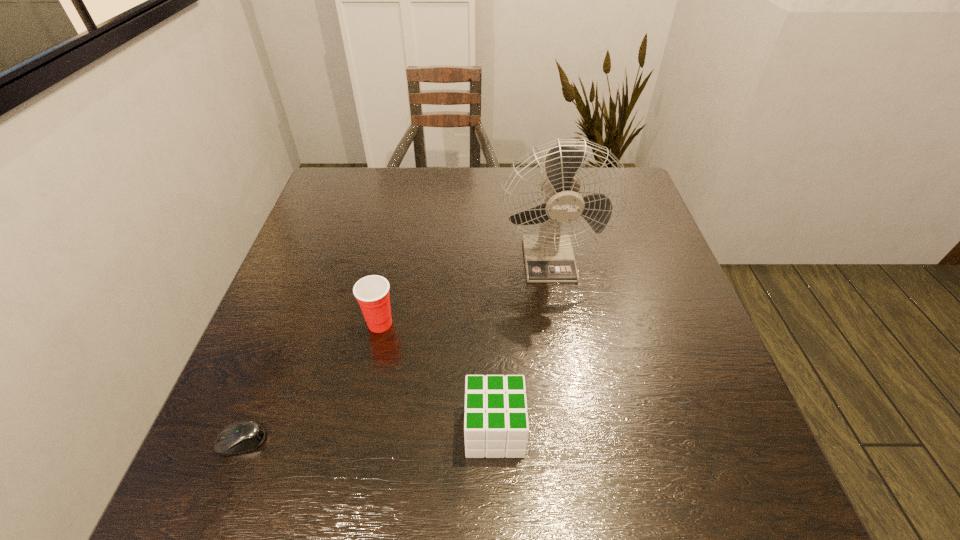
You are a GUI agent. You are given a task and a screenshot of the screen. Output one action in this format:
    pyautogui.click(x=<x>, y=<y>)
    Task: Click on the free point at the right edge
    Image resolution: width=960 pixels, height=540 pixels.
    Given the screenshot: What is the action you would take?
    pyautogui.click(x=617, y=239)

I want to click on free space at the far left corner of the desktop, so click(x=352, y=181).

In the image, there is a desktop. Find the location of `free space at the near left corner`. free space at the near left corner is located at coordinates (241, 471).

At what (x,y) coordinates should I click in order to perform the action: click on free space at the far right corner. Please return your answer as a coordinate pair (x, y). The image size is (960, 540). Looking at the image, I should click on (584, 172).

Locate an element on the screen. vacant region at the near right corner of the desktop is located at coordinates (757, 484).

The height and width of the screenshot is (540, 960). In order to click on empty space between the third object from right to left and the cube in this screenshot , I will do `click(437, 377)`.

You are a GUI agent. You are given a task and a screenshot of the screen. Output one action in this format:
    pyautogui.click(x=<x>, y=<y>)
    Task: Click on the free space between the mouse and the third object from right to left
    
    Given the screenshot: What is the action you would take?
    pyautogui.click(x=311, y=382)

Locate an element on the screen. blank region between the third nearest object and the cube is located at coordinates (437, 377).

The image size is (960, 540). Identify the location of vacant space that is in between the leftmost object and the farthest object. (396, 349).

I want to click on free space between the mouse and the tallest object, so click(x=396, y=349).